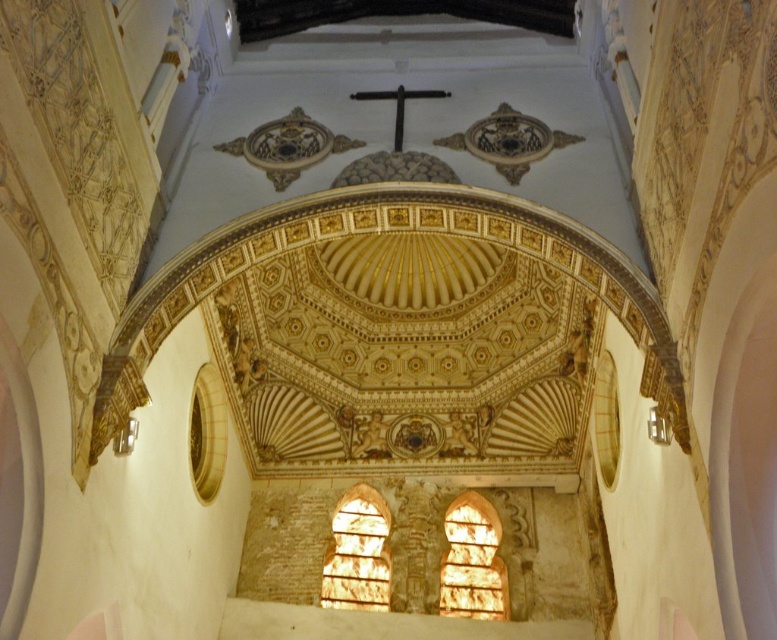
You are an architect designing a new lighting system for the grand space. You need to place a spotlight directly above the translucent glass window at center. According to the coordinates provided, where should the spotlight be positioned relative to the window?

The translucent glass window at center is located at point (472, 561), so the spotlight should be placed directly above this coordinate to illuminate it effectively.

You are an architect designing a new stained glass window for the cathedral. You have two options to choose from the image provided. The first is the translucent glass window at center, and the second is the translucent stone window at center. Which of these two options is smaller in size?

The translucent glass window at center has a smaller size compared to the translucent stone window at center, so the translucent glass window at center is the smaller option.